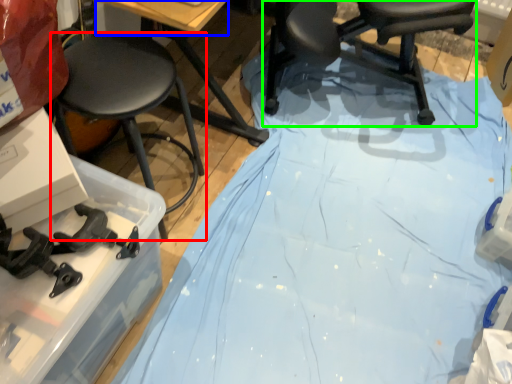
Question: Which object is positioned farthest from stool (highlighted by a red box)? Select from table top (highlighted by a blue box) and chair (highlighted by a green box).

Choices:
 (A) table top
 (B) chair

Answer: (B)